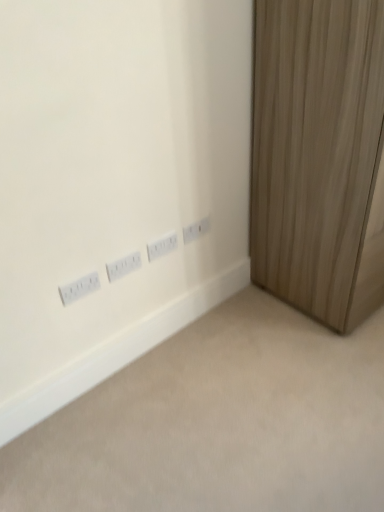
Question: In terms of width, does wooden curtain at right look wider or thinner when compared to white plastic power plugs and sockets at center, which ranks as the first power plugs and sockets in right-to-left order?

Choices:
 (A) thin
 (B) wide

Answer: (B)

Question: Considering the relative positions of wooden curtain at right and white plastic power plugs and sockets at center, which ranks as the first power plugs and sockets in right-to-left order, in the image provided, is wooden curtain at right to the left or to the right of white plastic power plugs and sockets at center, which ranks as the first power plugs and sockets in right-to-left order,?

Choices:
 (A) right
 (B) left

Answer: (A)

Question: Which object is the closest to the white plastic power plugs and sockets at center, which ranks as the first power plugs and sockets in right-to-left order?

Choices:
 (A) white plastic power plugs and sockets at lower left, marked as the 4th power plugs and sockets in a right-to-left arrangement
 (B) white plastic outlets at lower left
 (C) white plastic power plugs and sockets at center, the 3th power plugs and sockets in the left-to-right sequence
 (D) white plastic power plugs and sockets at center, the 3th power plugs and sockets viewed from the right
 (E) wooden curtain at right

Answer: (C)

Question: Which is nearer to the white plastic power plugs and sockets at center, marked as the 2th power plugs and sockets in a left-to-right arrangement?

Choices:
 (A) white plastic power plugs and sockets at center, the second power plugs and sockets from the right
 (B) wooden curtain at right
 (C) white plastic power plugs and sockets at center, the 4th power plugs and sockets in the left-to-right sequence
 (D) white plastic outlets at lower left
 (E) white plastic power plugs and sockets at lower left, marked as the 4th power plugs and sockets in a right-to-left arrangement

Answer: (A)